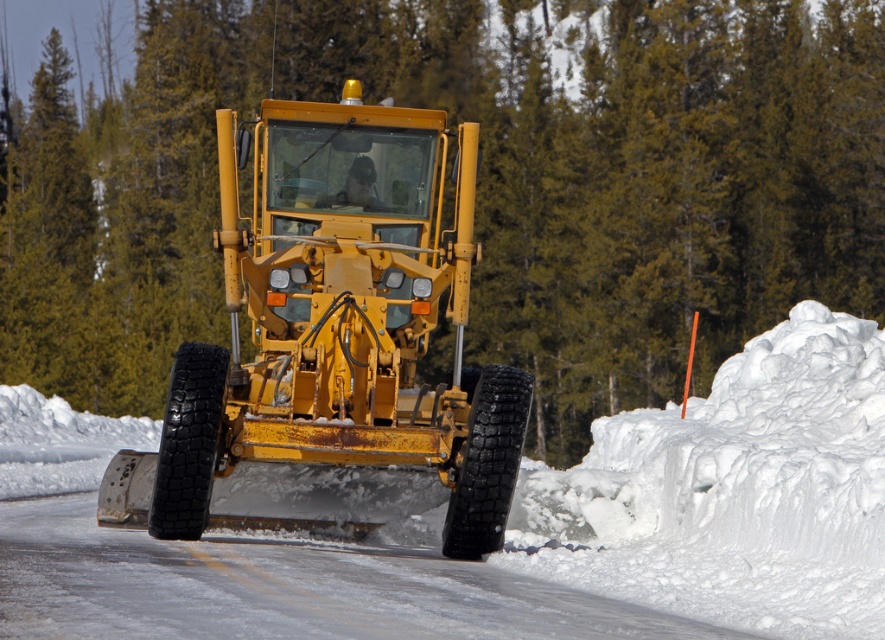
Can you confirm if green textured tree at upper center is smaller than yellow metallic snowplow at center?

Actually, green textured tree at upper center might be larger than yellow metallic snowplow at center.

I want to click on green textured tree at upper center, so click(476, 182).

Identify the location of green textured tree at upper center. (476, 182).

Measure the distance from white fluffy snow at center to yellow metallic snowplow at center.

white fluffy snow at center and yellow metallic snowplow at center are 4.06 meters apart.

In the scene shown: Can you confirm if white fluffy snow at center is bigger than yellow metallic snowplow at center?

Indeed, white fluffy snow at center has a larger size compared to yellow metallic snowplow at center.

Does point (414, 524) come closer to viewer compared to point (199, 403)?

No.

Where is `white fluffy snow at center`? white fluffy snow at center is located at coordinates (509, 525).

Can you confirm if green textured tree at upper center is positioned below white fluffy snow at center?

No.

How much distance is there between green textured tree at upper center and white fluffy snow at center?

They are 66.01 feet apart.

Between point (52, 198) and point (727, 544), which one is positioned in front?

Positioned in front is point (727, 544).

This screenshot has width=885, height=640. Find the location of `green textured tree at upper center`. green textured tree at upper center is located at coordinates (476, 182).